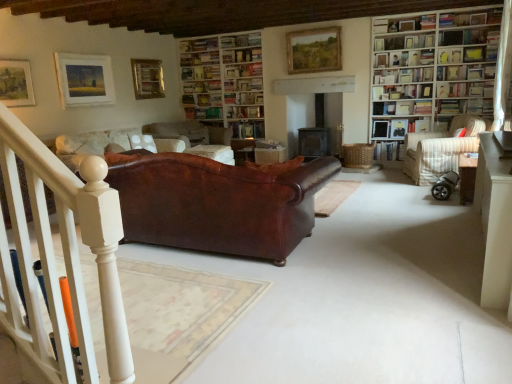
At what (x,y) coordinates should I click in order to perform the action: click on free space in front of leather couch at center. Please return your answer as a coordinate pair (x, y). The height and width of the screenshot is (384, 512). Looking at the image, I should click on (246, 308).